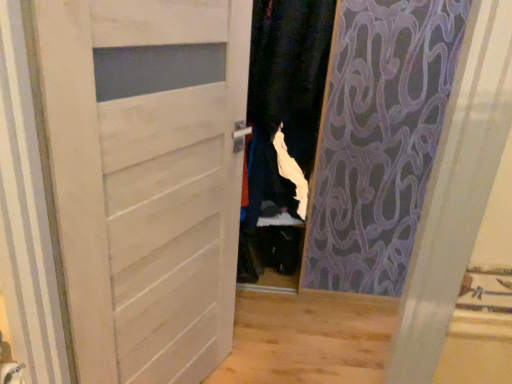
The height and width of the screenshot is (384, 512). Find the location of `white matte door at center`. white matte door at center is located at coordinates (146, 179).

Image resolution: width=512 pixels, height=384 pixels. What do you see at coordinates (146, 179) in the screenshot?
I see `white matte door at center` at bounding box center [146, 179].

Where is `white fabric at center`? Image resolution: width=512 pixels, height=384 pixels. white fabric at center is located at coordinates (290, 70).

The height and width of the screenshot is (384, 512). Describe the element at coordinates (290, 70) in the screenshot. I see `white fabric at center` at that location.

Identify the location of white matte door at center. coord(146,179).

Is white fabric at center to the left or to the right of white matte door at center in the image?

white fabric at center is positioned on white matte door at center's right side.

Is white fabric at center positioned behind white matte door at center?

Yes, it is.

Which is nearer, (277, 64) or (65, 97)?

The point (65, 97) is in front.

From the image's perspective, which one is positioned higher, white fabric at center or white matte door at center?

white fabric at center, from the image's perspective.

From a real-world perspective, is white fabric at center located higher than white matte door at center?

Yes, from a real-world perspective, white fabric at center is on top of white matte door at center.

Which object is thinner, white fabric at center or white matte door at center?

Thinner between the two is white matte door at center.

Between white fabric at center and white matte door at center, which one has more height?

With more height is white matte door at center.

From the picture: Is white fabric at center smaller than white matte door at center?

Incorrect, white fabric at center is not smaller in size than white matte door at center.

Is white matte door at center completely or partially inside white fabric at center?

No.

Is white fabric at center touching white matte door at center?

No.

Is white fabric at center looking in the opposite direction of white matte door at center?

No.

Where is `clothing above the white matte door at center (from the image's perspective)`? clothing above the white matte door at center (from the image's perspective) is located at coordinates (290, 70).

Is white matte door at center at the right side of white fabric at center?

In fact, white matte door at center is to the left of white fabric at center.

Between white matte door at center and white fabric at center, which one is positioned behind?

white fabric at center.

Which is further, (169, 137) or (267, 43)?

Positioned behind is point (267, 43).

From the image's perspective, would you say white matte door at center is shown under white fabric at center?

Correct, white matte door at center appears lower than white fabric at center in the image.

From a real-world perspective, is white matte door at center beneath white fabric at center?

Indeed, from a real-world perspective, white matte door at center is positioned beneath white fabric at center.

Considering the relative sizes of white matte door at center and white fabric at center in the image provided, is white matte door at center wider than white fabric at center?

No.

Can you confirm if white matte door at center is shorter than white fabric at center?

In fact, white matte door at center may be taller than white fabric at center.

In terms of size, does white matte door at center appear bigger or smaller than white fabric at center?

In the image, white matte door at center appears to be smaller than white fabric at center.

Can we say white matte door at center lies outside white fabric at center?

That's correct, white matte door at center is outside of white fabric at center.

Are white matte door at center and white fabric at center far apart?

No.

Is white fabric at center at the back of white matte door at center?

No, white matte door at center is not facing the opposite direction of white fabric at center.

Measure the distance from white matte door at center to white fabric at center.

white matte door at center and white fabric at center are 32.34 inches apart.

At what (x,y) coordinates should I click in order to perform the action: click on clothing lying on the right of white matte door at center. Please return your answer as a coordinate pair (x, y). This screenshot has width=512, height=384. Looking at the image, I should click on (290, 70).

The width and height of the screenshot is (512, 384). In order to click on clothing above the white matte door at center (from a real-world perspective) in this screenshot , I will do `click(290, 70)`.

Locate an element on the screen. clothing on the right of white matte door at center is located at coordinates (290, 70).